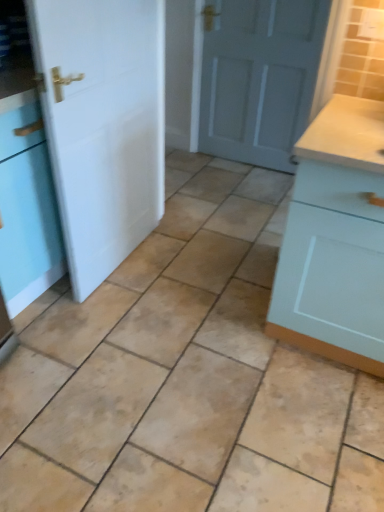
Locate an element on the screen. This screenshot has width=384, height=512. vacant area to the left of light blue wood cabinet at right is located at coordinates (214, 324).